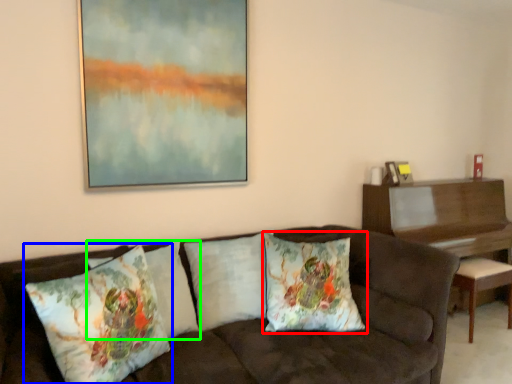
Question: Which is nearer to the pillow (highlighted by a red box)? pillow (highlighted by a blue box) or pillow (highlighted by a green box).

Choices:
 (A) pillow
 (B) pillow

Answer: (B)